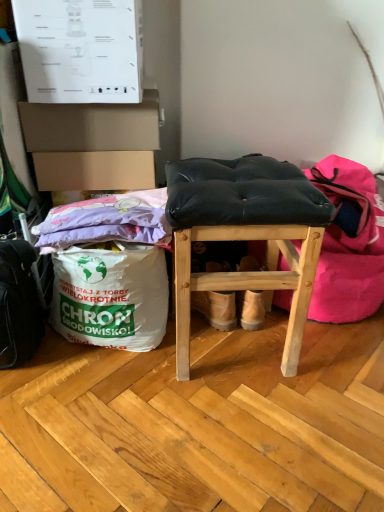
Describe the element at coordinates (245, 234) in the screenshot. The height and width of the screenshot is (512, 384). I see `black leather stool at center` at that location.

Where is `black leather stool at center`? The image size is (384, 512). black leather stool at center is located at coordinates (245, 234).

What is the approximate height of black fabric bean bag chair at center?

black fabric bean bag chair at center is 16.19 inches in height.

I want to click on white paper grocery bag at lower left, so click(x=111, y=296).

The height and width of the screenshot is (512, 384). Identify the location of purple fabric at left. (107, 221).

What do you see at coordinates (93, 144) in the screenshot? I see `cardboard box at upper left` at bounding box center [93, 144].

Identify the location of black leather stool at center. This screenshot has height=512, width=384. (245, 234).

Is white paper grocery bag at lower left spatially inside black fabric bean bag chair at center, or outside of it?

white paper grocery bag at lower left is located beyond the bounds of black fabric bean bag chair at center.

You are a GUI agent. You are given a task and a screenshot of the screen. Output one action in this format:
    pyautogui.click(x=<x>, y=<y>)
    Task: Click on the grocery bag that appears in front of the black fabric bean bag chair at center
    Image resolution: width=384 pixels, height=512 pixels.
    Given the screenshot: What is the action you would take?
    pyautogui.click(x=111, y=296)

Is white paper grocery bag at lower left bigger than black fabric bean bag chair at center?

Incorrect, white paper grocery bag at lower left is not larger than black fabric bean bag chair at center.

Is white paper grocery bag at lower left aimed at black fabric bean bag chair at center?

No, white paper grocery bag at lower left does not turn towards black fabric bean bag chair at center.

Where is `grocery bag lying on the right of black leather messenger bag at lower left`? The height and width of the screenshot is (512, 384). grocery bag lying on the right of black leather messenger bag at lower left is located at coordinates (111, 296).

Can you tell me how much white paper grocery bag at lower left and black leather messenger bag at lower left differ in facing direction?

5.77 degrees separate the facing orientations of white paper grocery bag at lower left and black leather messenger bag at lower left.

Does white paper grocery bag at lower left come in front of black leather messenger bag at lower left?

No, it is not.

Consider the image. Between white paper grocery bag at lower left and black leather messenger bag at lower left, which one has larger size?

Bigger between the two is white paper grocery bag at lower left.

Which object is positioned more to the left, black fabric bean bag chair at center or cardboard box at upper left?

From the viewer's perspective, cardboard box at upper left appears more on the left side.

Considering the points (368, 192) and (50, 156), which point is behind, point (368, 192) or point (50, 156)?

The point (50, 156) is farther from the camera.

From a real-world perspective, between black fabric bean bag chair at center and cardboard box at upper left, who is vertically lower?

black fabric bean bag chair at center is physically lower.

From the image's perspective, who appears lower, black fabric bean bag chair at center or cardboard box at upper left?

black fabric bean bag chair at center appears lower in the image.

Can you confirm if cardboard box at upper left is wider than black leather stool at center?

No.

Could you tell me if cardboard box at upper left is facing black leather stool at center?

No.

Find the location of a particular element. Image resolution: width=384 pixels, height=512 pixels. cardboard box behind the black leather stool at center is located at coordinates (93, 144).

Would you say cardboard box at upper left is to the left or to the right of black leather stool at center in the picture?

cardboard box at upper left is to the left of black leather stool at center.

Considering the sizes of objects black leather stool at center and cardboard box at upper left in the image provided, who is shorter, black leather stool at center or cardboard box at upper left?

cardboard box at upper left is shorter.

Can you confirm if black leather stool at center is positioned to the left of cardboard box at upper left?

No, black leather stool at center is not to the left of cardboard box at upper left.

Where is `furniture that is below the cardboard box at upper left (from the image's perspective)`? The width and height of the screenshot is (384, 512). furniture that is below the cardboard box at upper left (from the image's perspective) is located at coordinates 245,234.

Is black leather stool at center located outside cardboard box at upper left?

That's correct, black leather stool at center is outside of cardboard box at upper left.

Which of these two, white paper grocery bag at lower left or cardboard box at upper left, is smaller?

cardboard box at upper left is smaller.

Between white paper grocery bag at lower left and cardboard box at upper left, which one is positioned behind?

cardboard box at upper left is further away from the camera.

From a real-world perspective, is white paper grocery bag at lower left above or below cardboard box at upper left?

white paper grocery bag at lower left is below cardboard box at upper left.

Considering the sizes of objects black fabric bean bag chair at center and black leather stool at center in the image provided, who is smaller, black fabric bean bag chair at center or black leather stool at center?

Smaller between the two is black leather stool at center.

Would you consider black fabric bean bag chair at center to be distant from black leather stool at center?

No, black fabric bean bag chair at center is not far away from black leather stool at center.

From a real-world perspective, which object stands above the other?

Answer: black leather stool at center, from a real-world perspective.

Is black fabric bean bag chair at center positioned with its back to black leather stool at center?

black fabric bean bag chair at center is not turned away from black leather stool at center.

The width and height of the screenshot is (384, 512). In order to click on bean bag chair above the white paper grocery bag at lower left (from a real-world perspective) in this screenshot , I will do `click(349, 244)`.

This screenshot has width=384, height=512. I want to click on messenger bag on the left of white paper grocery bag at lower left, so click(18, 304).

Considering their positions, is black fabric bean bag chair at center positioned closer to purple fabric at left than cardboard box at upper left?

Among the two, cardboard box at upper left is located nearer to purple fabric at left.

Based on their spatial positions, is purple fabric at left or cardboard box at upper left closer to black leather messenger bag at lower left?

Among the two, purple fabric at left is located nearer to black leather messenger bag at lower left.

Looking at the image, which one is located closer to purple fabric at left, white paper grocery bag at lower left or black leather messenger bag at lower left?

white paper grocery bag at lower left lies closer to purple fabric at left than the other object.

Based on their spatial positions, is black leather stool at center or black fabric bean bag chair at center closer to purple fabric at left?

black leather stool at center is positioned closer to the anchor purple fabric at left.

Estimate the real-world distances between objects in this image. Which object is closer to black fabric bean bag chair at center, purple fabric at left or white paper grocery bag at lower left?

white paper grocery bag at lower left lies closer to black fabric bean bag chair at center than the other object.

Based on their spatial positions, is cardboard box at upper left or black leather messenger bag at lower left closer to black leather stool at center?

Based on the image, cardboard box at upper left appears to be nearer to black leather stool at center.

Estimate the real-world distances between objects in this image. Which object is closer to black leather messenger bag at lower left, cardboard box at upper left or black leather stool at center?

cardboard box at upper left is closer to black leather messenger bag at lower left.

When comparing their distances from black fabric bean bag chair at center, does white paper grocery bag at lower left or cardboard box at upper left seem closer?

white paper grocery bag at lower left is closer to black fabric bean bag chair at center.

The image size is (384, 512). Find the location of `furniture between white paper grocery bag at lower left and black fabric bean bag chair at center from left to right`. furniture between white paper grocery bag at lower left and black fabric bean bag chair at center from left to right is located at coordinates (245, 234).

Locate an element on the screen. The image size is (384, 512). furniture that lies between cardboard box at upper left and white paper grocery bag at lower left from top to bottom is located at coordinates (245, 234).

You are a GUI agent. You are given a task and a screenshot of the screen. Output one action in this format:
    pyautogui.click(x=<x>, y=<y>)
    Task: Click on the material between black leather messenger bag at lower left and black fabric bean bag chair at center from left to right
    This screenshot has width=384, height=512.
    Given the screenshot: What is the action you would take?
    pyautogui.click(x=107, y=221)

Locate an element on the screen. This screenshot has height=512, width=384. furniture between purple fabric at left and black fabric bean bag chair at center from left to right is located at coordinates (245, 234).